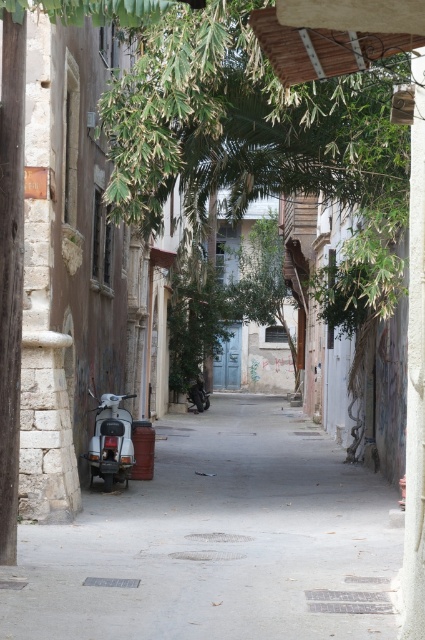
Question: Which object is positioned closest to the shiny black motorcycle at center?

Choices:
 (A) white matte scooter at left
 (B) white matte scooter at lower left

Answer: (A)

Question: Which of the following is the farthest from the observer?

Choices:
 (A) (198, 412)
 (B) (90, 461)

Answer: (A)

Question: Is white matte scooter at left thinner than white matte scooter at lower left?

Choices:
 (A) yes
 (B) no

Answer: (B)

Question: In this image, where is white matte scooter at lower left located relative to shiny black motorcycle at center?

Choices:
 (A) below
 (B) above

Answer: (B)

Question: Which object is closer to the camera taking this photo?

Choices:
 (A) white matte scooter at lower left
 (B) shiny black motorcycle at center

Answer: (A)

Question: Is white matte scooter at left positioned at the back of white matte scooter at lower left?

Choices:
 (A) yes
 (B) no

Answer: (B)